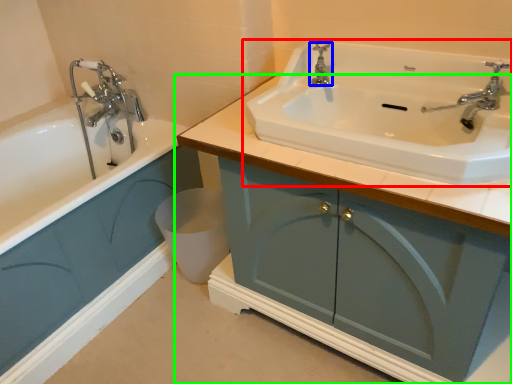
Question: Which is nearer to the sink (highlighted by a red box)? tap (highlighted by a blue box) or bathroom cabinet (highlighted by a green box).

Choices:
 (A) tap
 (B) bathroom cabinet

Answer: (B)